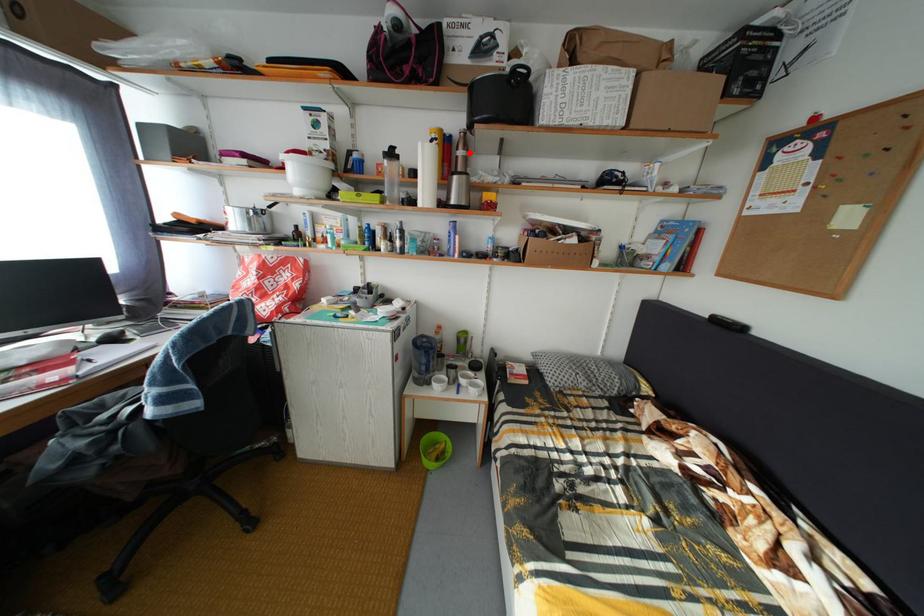
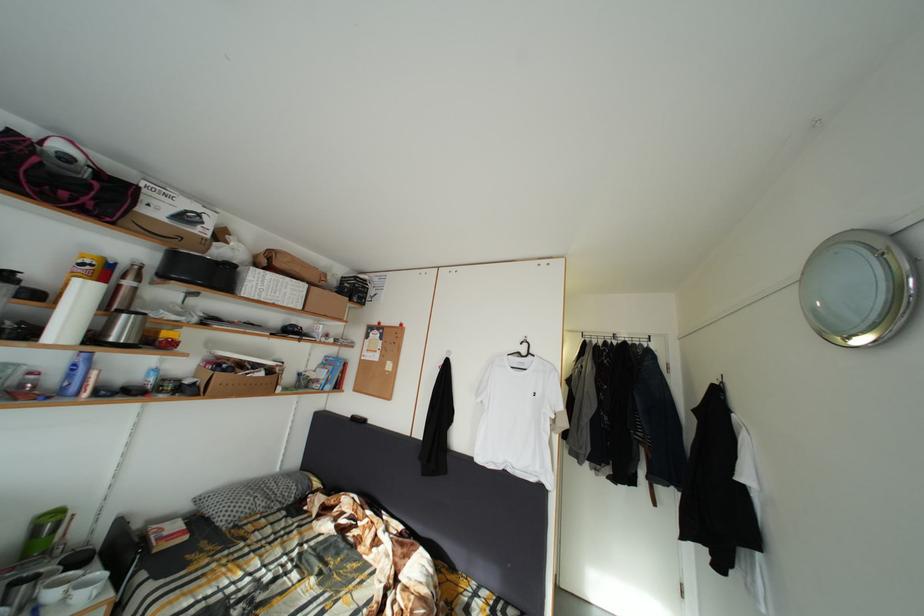
Find the pixel in the second image that matches the highlighted location in the first image.

(140, 283)